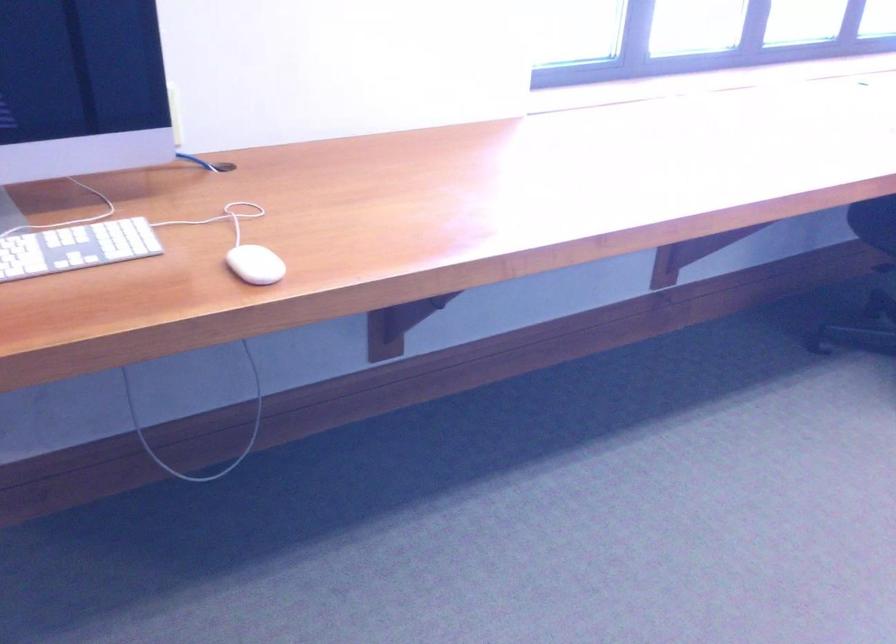
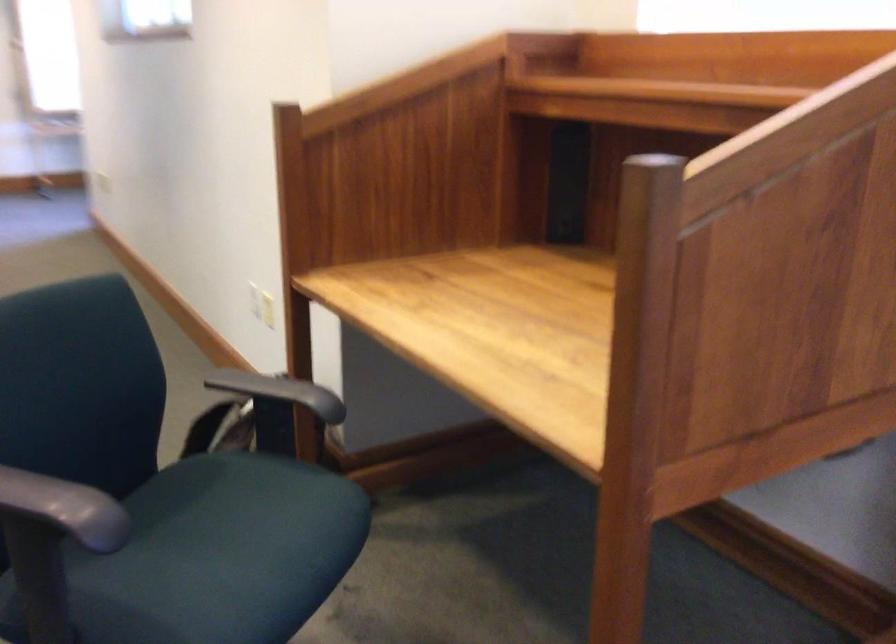
Question: How did the camera likely rotate?

Choices:
 (A) Left
 (B) Right
 (C) Up
 (D) Down

Answer: (A)